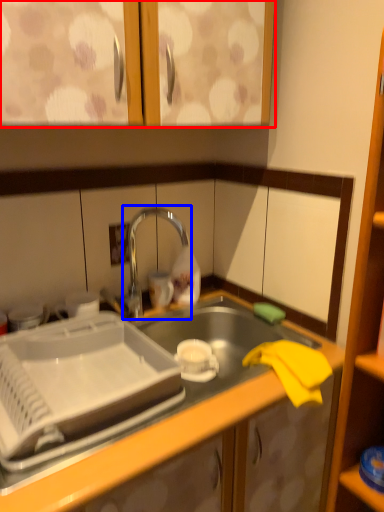
Question: Among these objects, which one is farthest to the camera, cabinetry (highlighted by a red box) or tap (highlighted by a blue box)?

Choices:
 (A) cabinetry
 (B) tap

Answer: (B)